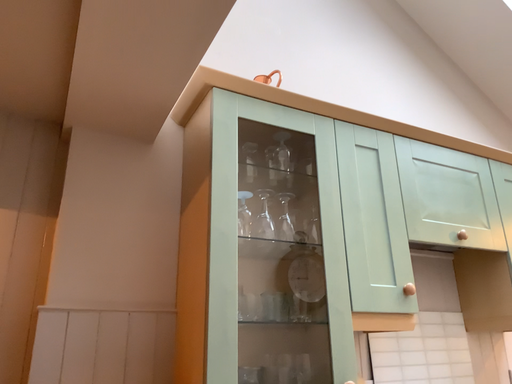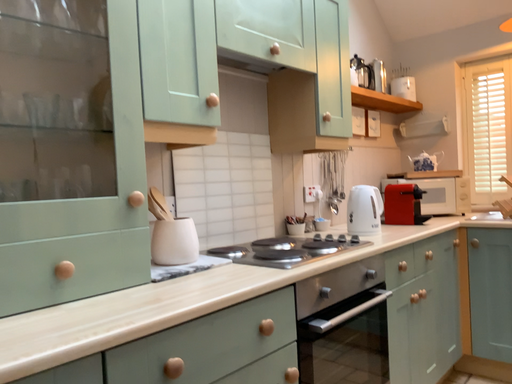
Question: How did the camera likely rotate when shooting the video?

Choices:
 (A) rotated left
 (B) rotated right

Answer: (B)